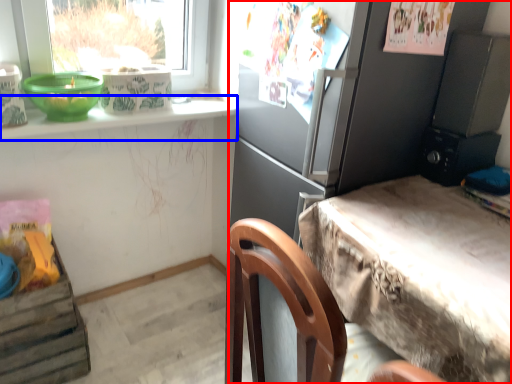
Question: Which object is closer to the camera taking this photo, cabinetry (highlighted by a red box) or window sill (highlighted by a blue box)?

Choices:
 (A) cabinetry
 (B) window sill

Answer: (A)